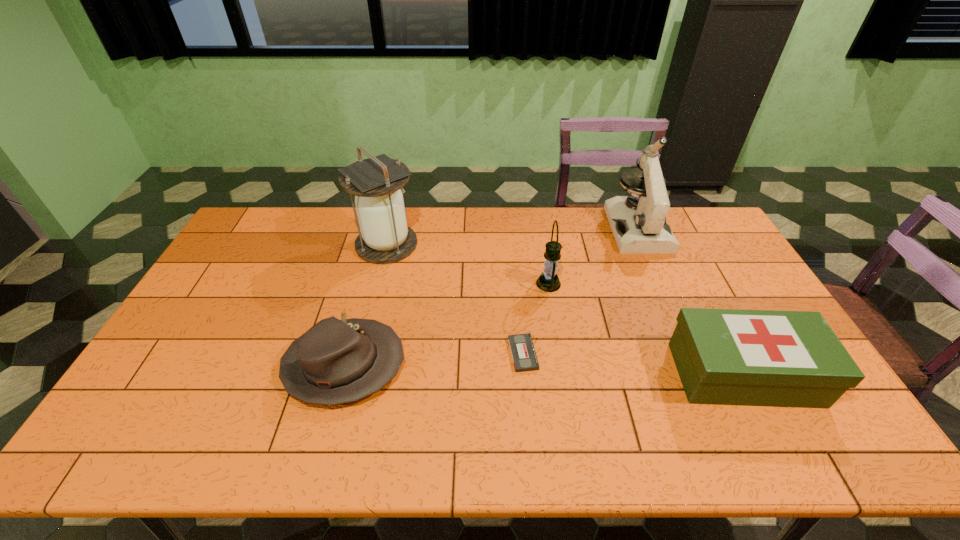
The height and width of the screenshot is (540, 960). What are the coordinates of `free space at the far edge of the desktop` in the screenshot? It's located at (567, 243).

Where is `vacant space at the near edge of the desktop`? vacant space at the near edge of the desktop is located at coordinates (x=653, y=453).

The width and height of the screenshot is (960, 540). I want to click on vacant space at the left edge of the desktop, so click(181, 363).

The width and height of the screenshot is (960, 540). Find the location of `blank space at the right edge`. blank space at the right edge is located at coordinates (701, 248).

You are a GUI agent. You are given a task and a screenshot of the screen. Output one action in this format:
    pyautogui.click(x=<x>, y=<y>)
    Task: Click on the free space between the left lantern and the shorter lantern
    The image size is (960, 540).
    Given the screenshot: What is the action you would take?
    pyautogui.click(x=468, y=264)

This screenshot has height=540, width=960. Identify the location of empty space between the second shortest object and the nearer lantern. pyautogui.click(x=446, y=325).

I want to click on free space between the taller lantern and the second shortest object, so click(366, 305).

Find the location of a particular element. The width and height of the screenshot is (960, 540). vacant area that lies between the first-aid kit and the taller lantern is located at coordinates (565, 309).

The width and height of the screenshot is (960, 540). Identify the location of free area in between the microscope and the nearer lantern. (593, 256).

Find the location of a particular element. empty space between the microscope and the videotape is located at coordinates (580, 291).